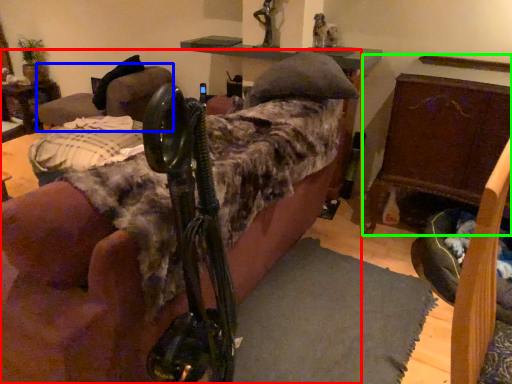
Question: Which is farther away from furniture (highlighted by a red box)? swivel chair (highlighted by a blue box) or furniture (highlighted by a green box)?

Choices:
 (A) swivel chair
 (B) furniture

Answer: (A)